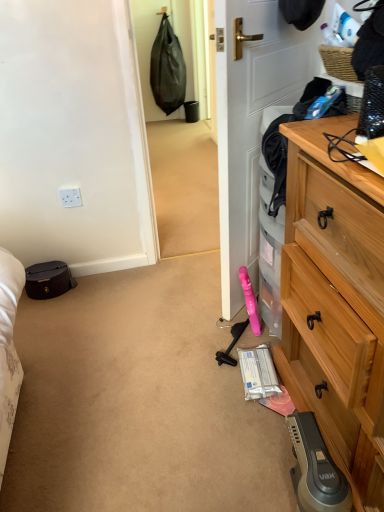
Where is `vacant area that lies between white matte door at center and matte black suitcase at left`? vacant area that lies between white matte door at center and matte black suitcase at left is located at coordinates (x=149, y=291).